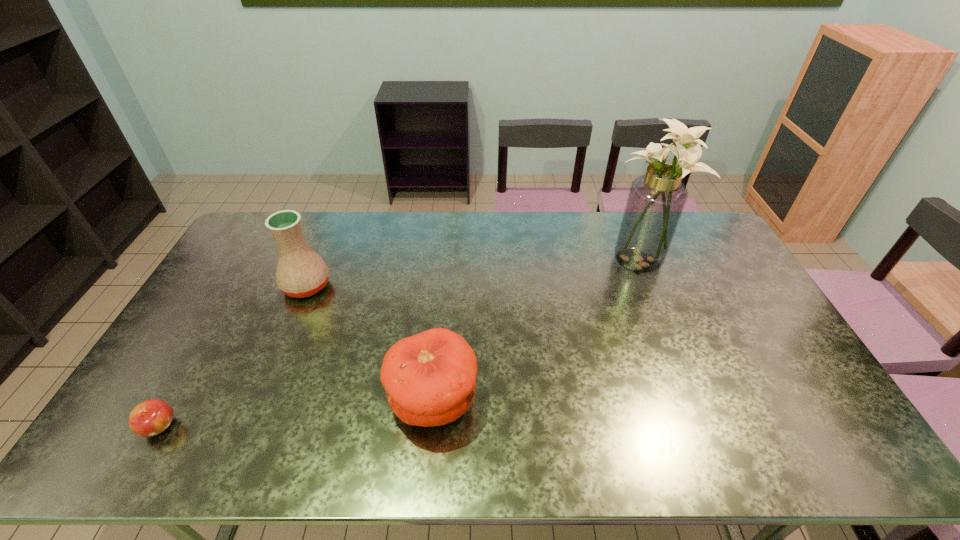
Identify the location of free space located 0.240m on the back of the third tallest object. The width and height of the screenshot is (960, 540). (442, 301).

In order to click on vacant space situated 0.110m on the right of the shortest object in this screenshot , I will do `click(221, 427)`.

This screenshot has width=960, height=540. Identify the location of object that is at the far edge. (656, 200).

Locate an element on the screen. Image resolution: width=960 pixels, height=540 pixels. pumpkin situated at the near edge is located at coordinates (429, 378).

You are a GUI agent. You are given a task and a screenshot of the screen. Output one action in this format:
    pyautogui.click(x=<x>, y=<y>)
    Task: Click on the apple present at the near edge
    
    Given the screenshot: What is the action you would take?
    pyautogui.click(x=152, y=417)

Where is `object positioned at the left edge`? object positioned at the left edge is located at coordinates (152, 417).

At what (x,y) coordinates should I click in order to perform the action: click on object that is positioned at the near left corner. Please return your answer as a coordinate pair (x, y). The image size is (960, 540). Looking at the image, I should click on (152, 417).

Where is `free space at the far edge`? The width and height of the screenshot is (960, 540). free space at the far edge is located at coordinates point(457,217).

Where is `free space at the near edge of the desktop`? This screenshot has height=540, width=960. free space at the near edge of the desktop is located at coordinates (497, 436).

Where is `free region at the left edge of the desktop`? free region at the left edge of the desktop is located at coordinates (237, 315).